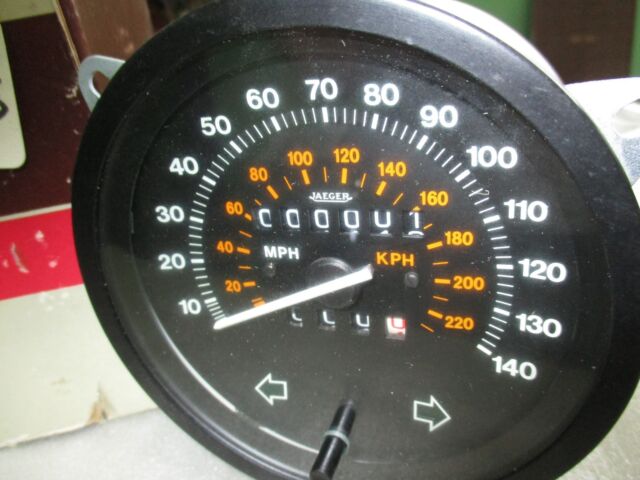
Find the location of a particular element. The image size is (640, 480). counter top is located at coordinates (112, 441).